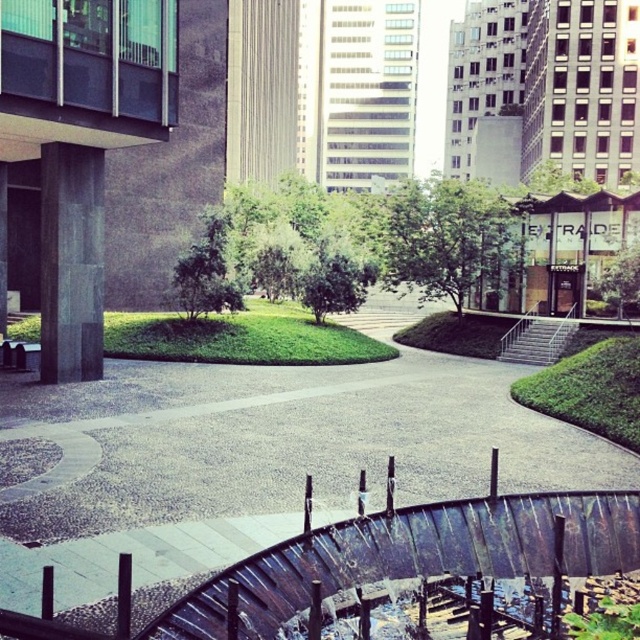
Which is behind, point (301, 456) or point (445, 208)?

Positioned behind is point (445, 208).

Who is lower down, gravel pathway at center or green leafy tree at center?

gravel pathway at center

The image size is (640, 640). What do you see at coordinates (340, 497) in the screenshot?
I see `gravel pathway at center` at bounding box center [340, 497].

The image size is (640, 640). I want to click on gravel pathway at center, so click(x=340, y=497).